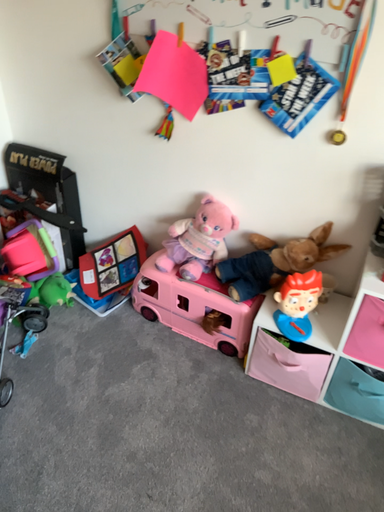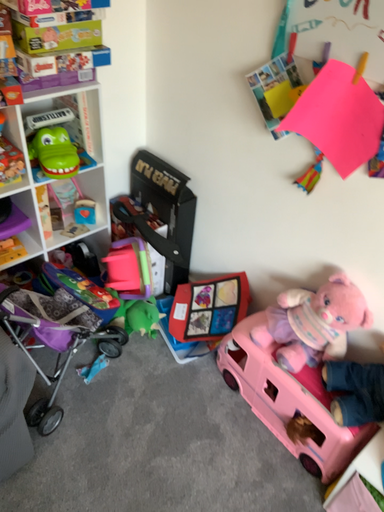
Question: How did the camera likely rotate when shooting the video?

Choices:
 (A) rotated right
 (B) rotated left

Answer: (B)